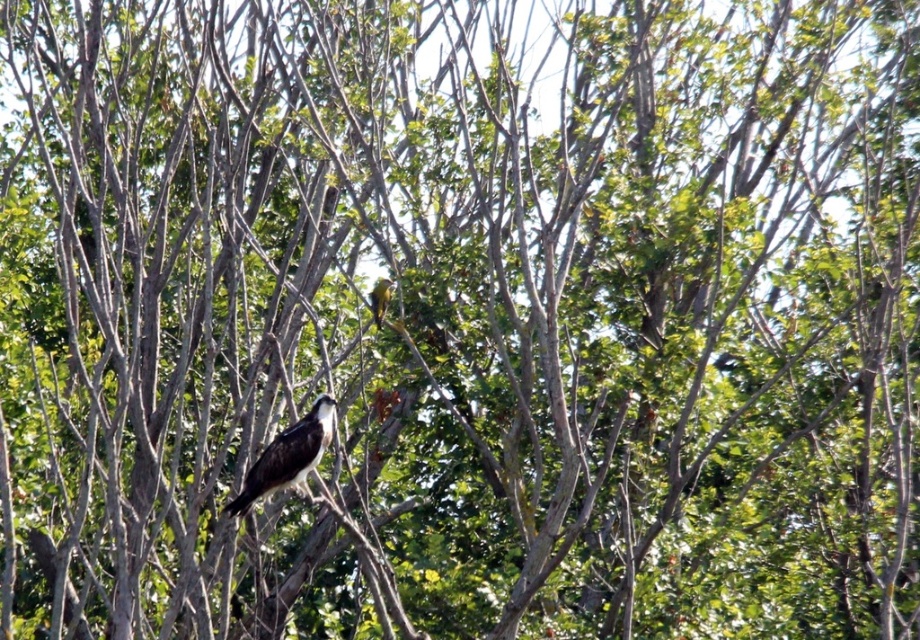
Can you confirm if brown feathered bird at center is taller than golden yellow parrot at upper center?

Correct, brown feathered bird at center is much taller as golden yellow parrot at upper center.

Is brown feathered bird at center bigger than golden yellow parrot at upper center?

Indeed, brown feathered bird at center has a larger size compared to golden yellow parrot at upper center.

Which is in front, point (303, 467) or point (370, 291)?

Positioned in front is point (303, 467).

This screenshot has width=920, height=640. I want to click on brown feathered bird at center, so click(x=286, y=456).